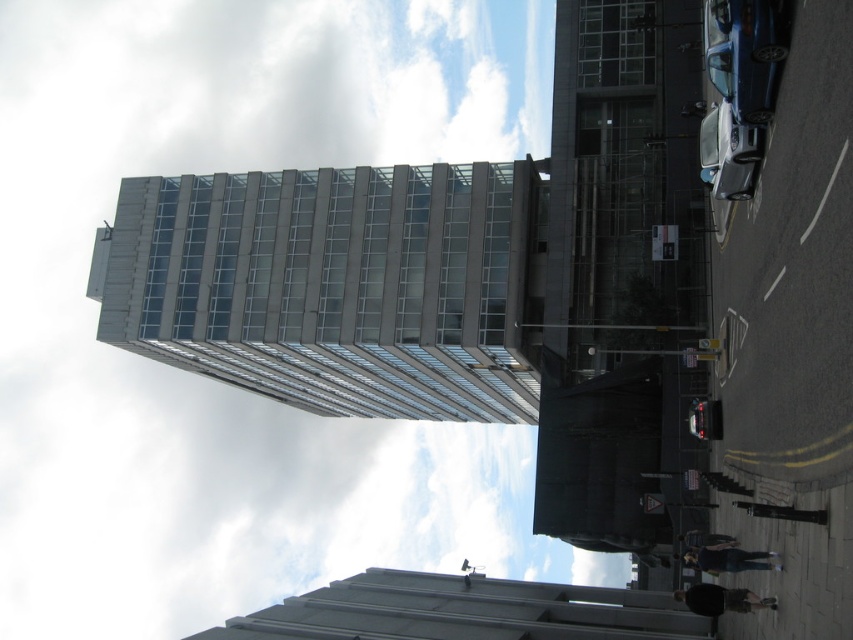
Question: Is glassy concrete tower at center above glassy concrete building at center?

Choices:
 (A) no
 (B) yes

Answer: (A)

Question: Can you confirm if white glass building at upper center is positioned above glassy concrete tower at center?

Choices:
 (A) no
 (B) yes

Answer: (B)

Question: Does white glass building at upper center have a lesser width compared to glassy concrete tower at center?

Choices:
 (A) no
 (B) yes

Answer: (A)

Question: Which object is closer to the camera taking this photo?

Choices:
 (A) white glass building at upper center
 (B) glassy concrete building at center
 (C) glassy concrete tower at center

Answer: (B)

Question: Among these points, which one is nearest to the camera?

Choices:
 (A) (595, 332)
 (B) (180, 513)
 (C) (421, 362)

Answer: (A)

Question: Which object is farther from the camera taking this photo?

Choices:
 (A) glassy concrete building at center
 (B) glassy concrete tower at center

Answer: (B)